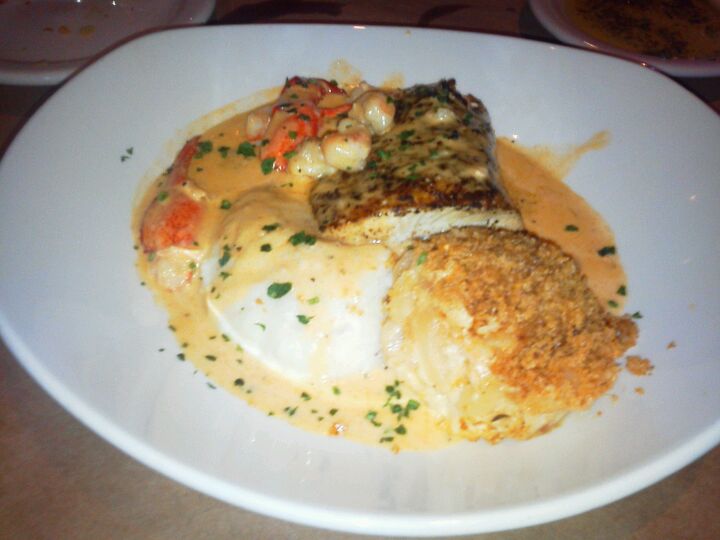
The height and width of the screenshot is (540, 720). In order to click on bread roll on plate with sauce in this screenshot , I will do `click(456, 354)`.